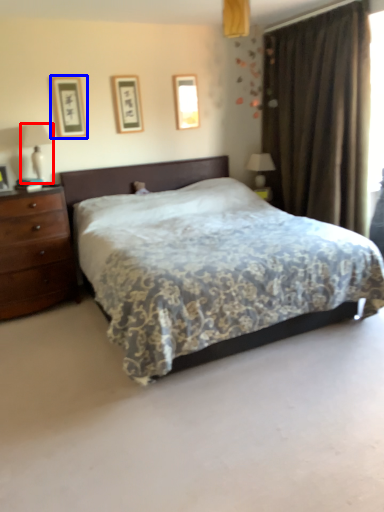
Question: Which of the following is the closest to the observer, table lamp (highlighted by a red box) or picture frame (highlighted by a blue box)?

Choices:
 (A) table lamp
 (B) picture frame

Answer: (A)